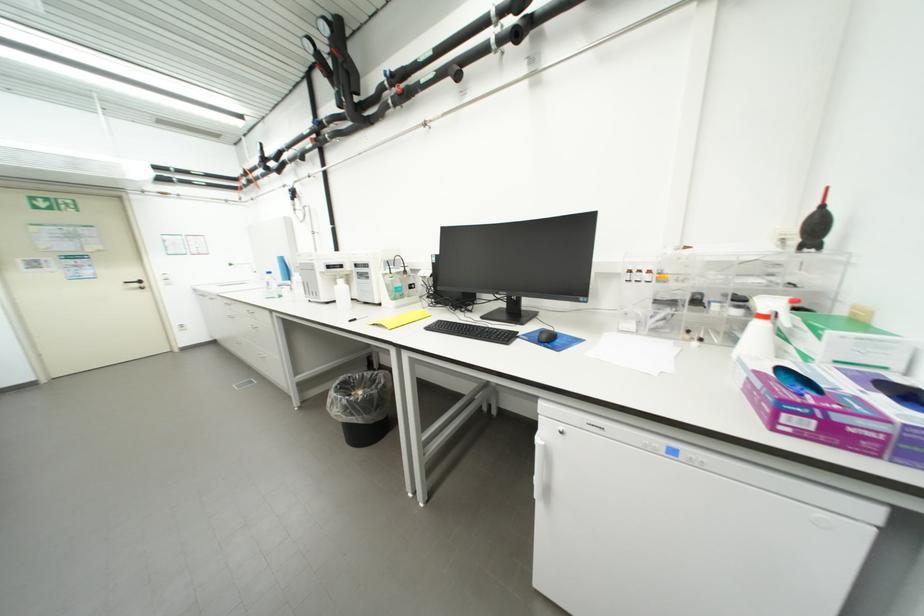
Identify the location of white fridge handle. (538, 469).